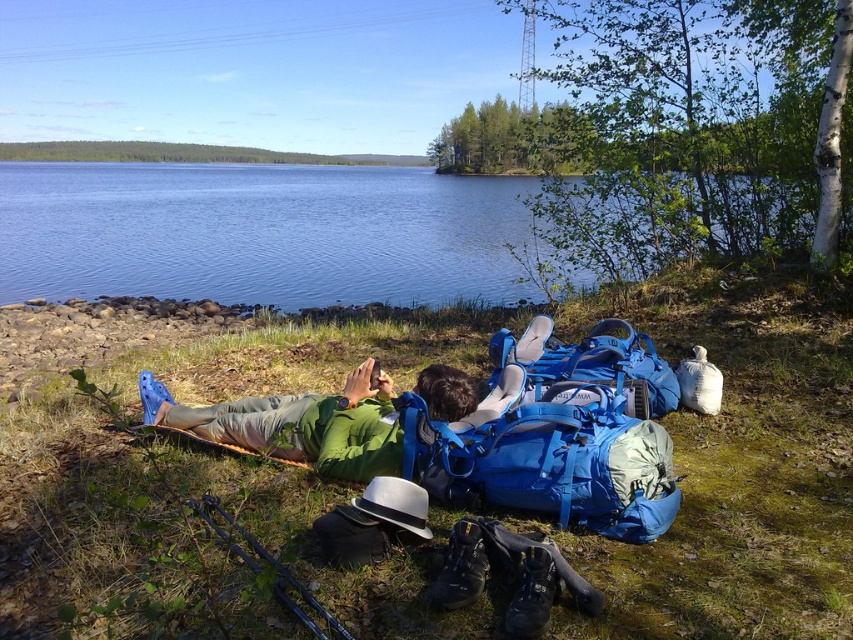
Question: Which object is closer to the camera taking this photo?

Choices:
 (A) green fabric person at center
 (B) green grass at lower center

Answer: (B)

Question: Can you confirm if green grass at lower center is thinner than blue water at center?

Choices:
 (A) no
 (B) yes

Answer: (B)

Question: Which of the following is the farthest from the observer?

Choices:
 (A) green grass at lower center
 (B) blue water at center
 (C) green fabric person at center

Answer: (B)

Question: Which point is closer to the camera?

Choices:
 (A) (434, 300)
 (B) (6, 540)
 (C) (236, 413)

Answer: (B)

Question: Can you confirm if blue water at center is positioned to the left of green fabric person at center?

Choices:
 (A) yes
 (B) no

Answer: (A)

Question: Does blue water at center have a larger size compared to green fabric person at center?

Choices:
 (A) yes
 (B) no

Answer: (A)